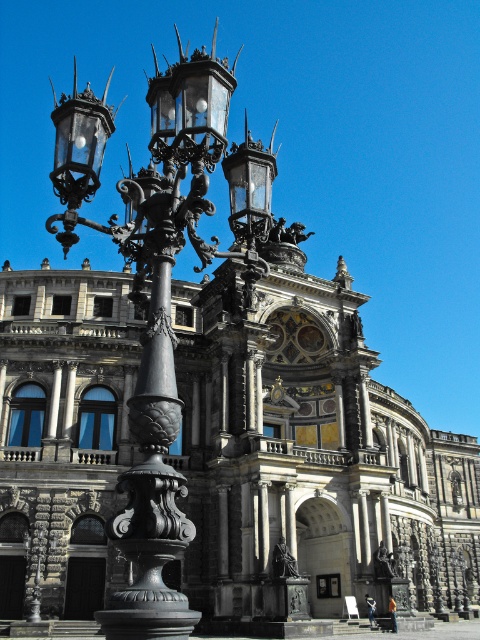
Question: Which point is farther to the camera?

Choices:
 (A) dark gray stone palace at center
 (B) polished bronze street light at left

Answer: (A)

Question: Does dark gray stone palace at center have a smaller size compared to polished bronze street light at left?

Choices:
 (A) no
 (B) yes

Answer: (B)

Question: Is dark gray stone palace at center to the right of polished bronze street light at left from the viewer's perspective?

Choices:
 (A) yes
 (B) no

Answer: (A)

Question: Which object appears farthest from the camera in this image?

Choices:
 (A) dark gray stone palace at center
 (B) polished bronze street light at left

Answer: (A)

Question: Does dark gray stone palace at center have a greater width compared to polished bronze street light at left?

Choices:
 (A) no
 (B) yes

Answer: (B)